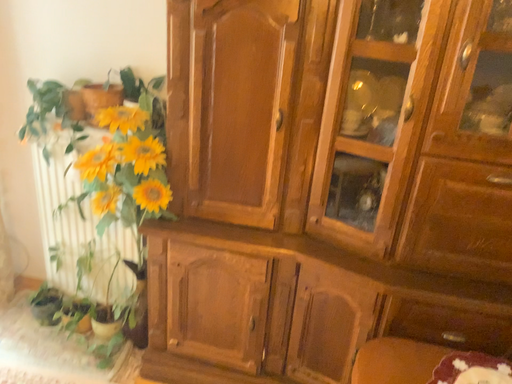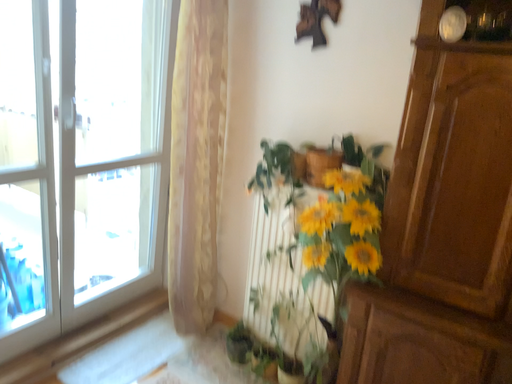
Question: Which way did the camera rotate in the video?

Choices:
 (A) rotated upward
 (B) rotated downward

Answer: (A)